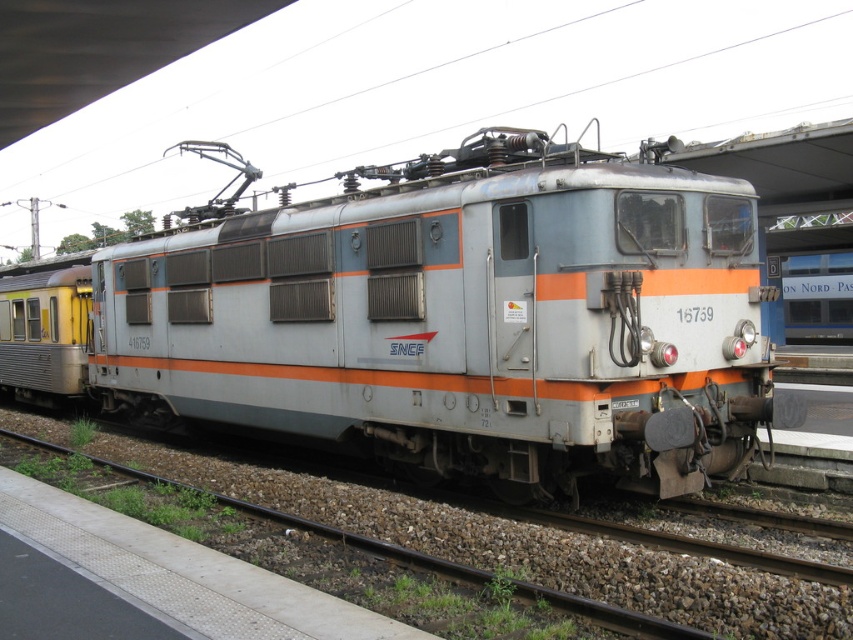
From the picture: Does matte silver train at center have a lesser height compared to silver metallic train at center?

No.

Which of these two, matte silver train at center or silver metallic train at center, stands shorter?

With less height is silver metallic train at center.

Which is in front, point (717, 358) or point (825, 330)?

Positioned in front is point (717, 358).

At what (x,y) coordinates should I click in order to perform the action: click on matte silver train at center. Please return your answer as a coordinate pair (x, y). Looking at the image, I should click on (463, 316).

Which is more to the right, yellow matte train car at left or silver metallic train at center?

Positioned to the right is silver metallic train at center.

Does yellow matte train car at left have a greater height compared to silver metallic train at center?

Yes, yellow matte train car at left is taller than silver metallic train at center.

Is point (88, 326) positioned before point (799, 314)?

Yes.

At what (x,y) coordinates should I click in order to perform the action: click on yellow matte train car at left. Please return your answer as a coordinate pair (x, y). The height and width of the screenshot is (640, 853). Looking at the image, I should click on 45,333.

This screenshot has width=853, height=640. What do you see at coordinates (463, 316) in the screenshot?
I see `matte silver train at center` at bounding box center [463, 316].

Between matte silver train at center and yellow matte train car at left, which one is positioned lower?

Positioned lower is yellow matte train car at left.

Measure the distance between point (494, 362) and camera.

The distance of point (494, 362) from camera is 7.61 meters.

I want to click on matte silver train at center, so click(463, 316).